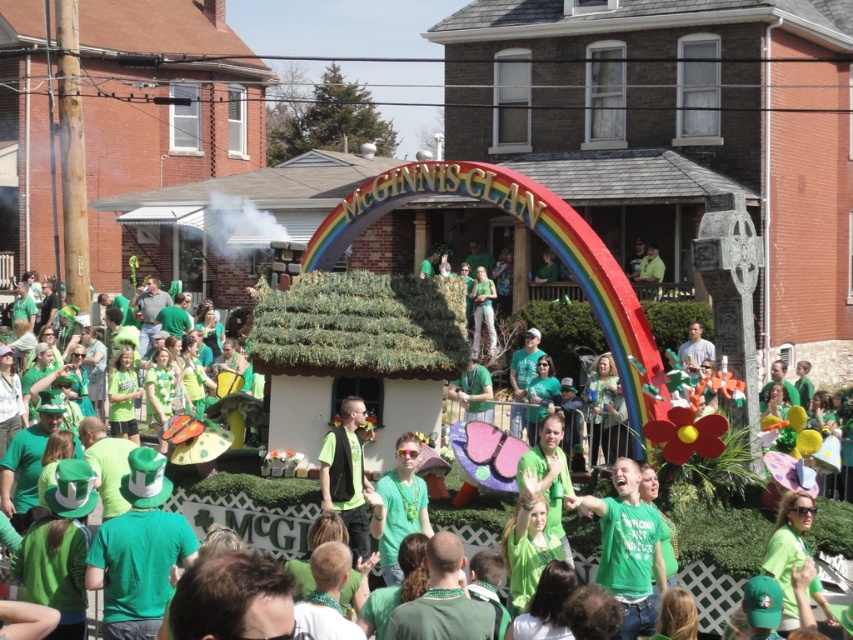
Which is more to the right, matte green float at center or green matte shirt at center?

green matte shirt at center

Where is `matte green float at center`? The height and width of the screenshot is (640, 853). matte green float at center is located at coordinates (248, 515).

Which is behind, point (256, 502) or point (346, 426)?

The point (256, 502) is more distant.

Can you confirm if matte green float at center is shorter than green matte vest at center?

In fact, matte green float at center may be taller than green matte vest at center.

Where is `matte green float at center`? matte green float at center is located at coordinates (248, 515).

Based on the photo, who is shorter, green matte shirt at center or green matte vest at center?

green matte shirt at center

Who is more distant from viewer, (622, 630) or (346, 504)?

The point (346, 504) is behind.

Where is `green matte shirt at center`? The height and width of the screenshot is (640, 853). green matte shirt at center is located at coordinates (627, 548).